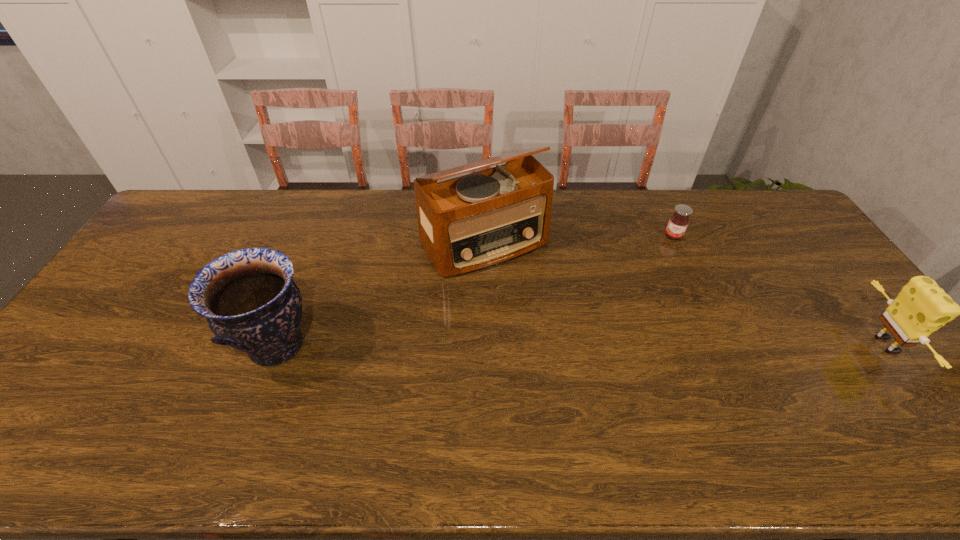
At what (x,y) coordinates should I click in order to perform the action: click on sponge at the near edge. Please return your answer as a coordinate pair (x, y). This screenshot has width=960, height=540. Looking at the image, I should click on (921, 307).

Find the location of a particular element. The image size is (960, 540). object that is at the right edge is located at coordinates (921, 307).

Find the location of a particular element. The image size is (960, 540). object present at the near right corner is located at coordinates (921, 307).

You are a GUI agent. You are given a task and a screenshot of the screen. Output one action in this format:
    pyautogui.click(x=<x>, y=<y>)
    Task: Click on the vacant space at the far edge of the desktop
    The width and height of the screenshot is (960, 540).
    Given the screenshot: What is the action you would take?
    pyautogui.click(x=677, y=197)

In the image, there is a desktop. In order to click on vacant space at the near edge in this screenshot , I will do `click(422, 393)`.

The image size is (960, 540). In the image, there is a desktop. Identify the location of free region at the right edge. (804, 299).

At what (x,y) coordinates should I click in order to perform the action: click on vacant space at the near left corner of the desktop. Please return your answer as a coordinate pair (x, y). Looking at the image, I should click on (75, 410).

The height and width of the screenshot is (540, 960). In the image, there is a desktop. Find the location of `free region at the far right corner`. free region at the far right corner is located at coordinates (761, 191).

Find the location of a particular element. free space at the near right corner is located at coordinates (908, 401).

Find the location of a particular element. empty space between the tallest object and the second tallest object is located at coordinates (381, 294).